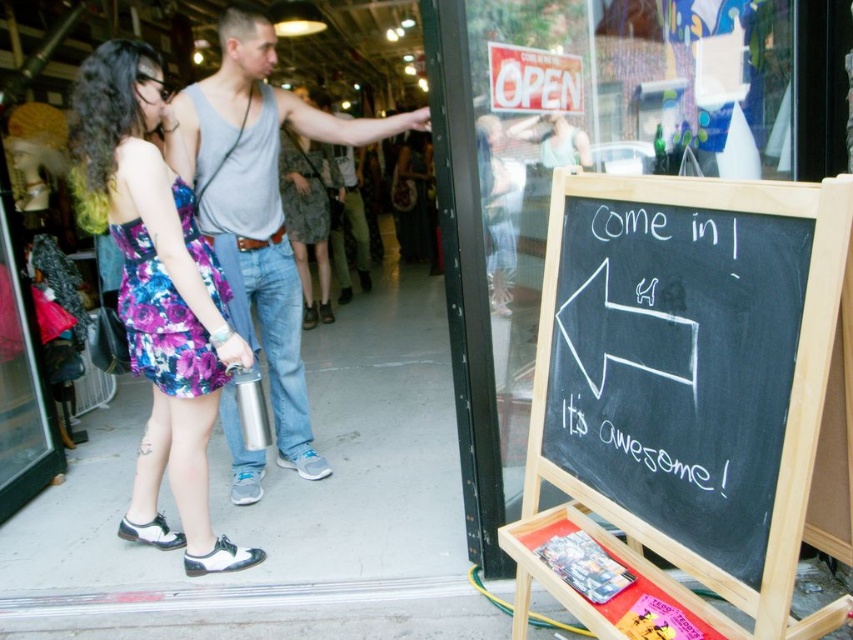
Question: Does floral fabric dress at center come in front of gray tank top at center?

Choices:
 (A) no
 (B) yes

Answer: (B)

Question: Which point appears farthest from the camera in this image?

Choices:
 (A) (299, 468)
 (B) (122, 300)

Answer: (A)

Question: Among these objects, which one is nearest to the camera?

Choices:
 (A) black chalkboard at lower right
 (B) gray tank top at center
 (C) floral fabric dress at center

Answer: (A)

Question: Is black chalkboard at lower right positioned at the back of gray tank top at center?

Choices:
 (A) yes
 (B) no

Answer: (B)

Question: Based on their relative distances, which object is nearer to the gray tank top at center?

Choices:
 (A) black chalkboard at lower right
 (B) floral fabric dress at center

Answer: (B)

Question: Does black chalkboard at lower right have a larger size compared to gray tank top at center?

Choices:
 (A) no
 (B) yes

Answer: (A)